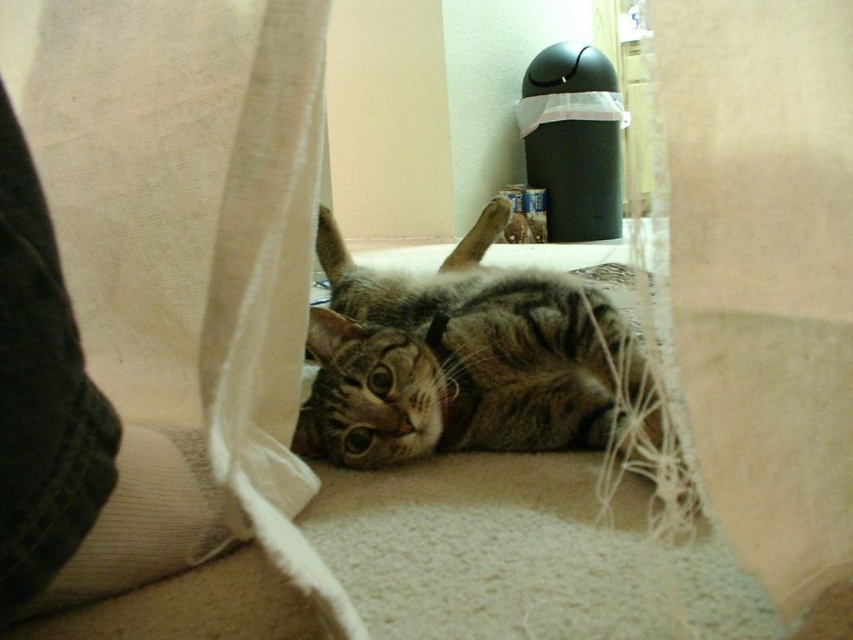
Based on the photo, measure the distance between point [85,262] and camera.

Point [85,262] is 23.61 inches away from camera.

Is white fabric curtain at lower left bigger than tabby fur cat at center?

Incorrect, white fabric curtain at lower left is not larger than tabby fur cat at center.

I want to click on white fabric curtain at lower left, so click(183, 266).

Looking at this image, is tabby fur cat at center above denim at left?

Correct, tabby fur cat at center is located above denim at left.

Looking at this image, is tabby fur cat at center taller than denim at left?

Yes, tabby fur cat at center is taller than denim at left.

Locate an element on the screen. This screenshot has width=853, height=640. tabby fur cat at center is located at coordinates (463, 358).

What do you see at coordinates (183, 266) in the screenshot? I see `white fabric curtain at lower left` at bounding box center [183, 266].

Between point (144, 305) and point (56, 548), which one is positioned in front?

Point (56, 548)

The width and height of the screenshot is (853, 640). Describe the element at coordinates (183, 266) in the screenshot. I see `white fabric curtain at lower left` at that location.

Where is `white fabric curtain at lower left`? white fabric curtain at lower left is located at coordinates (183, 266).